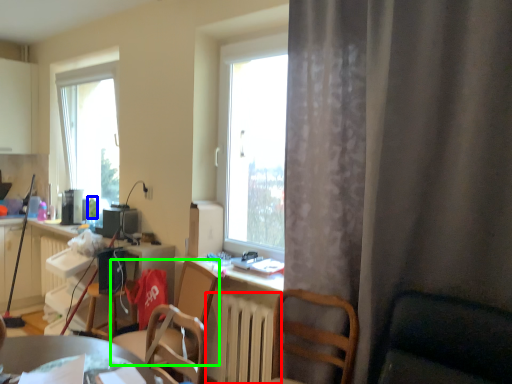
Question: Based on their relative distances, which object is nearer to radiator (highlighted by a red box)? Choose from bottle (highlighted by a blue box) and chair (highlighted by a green box).

Choices:
 (A) bottle
 (B) chair

Answer: (B)